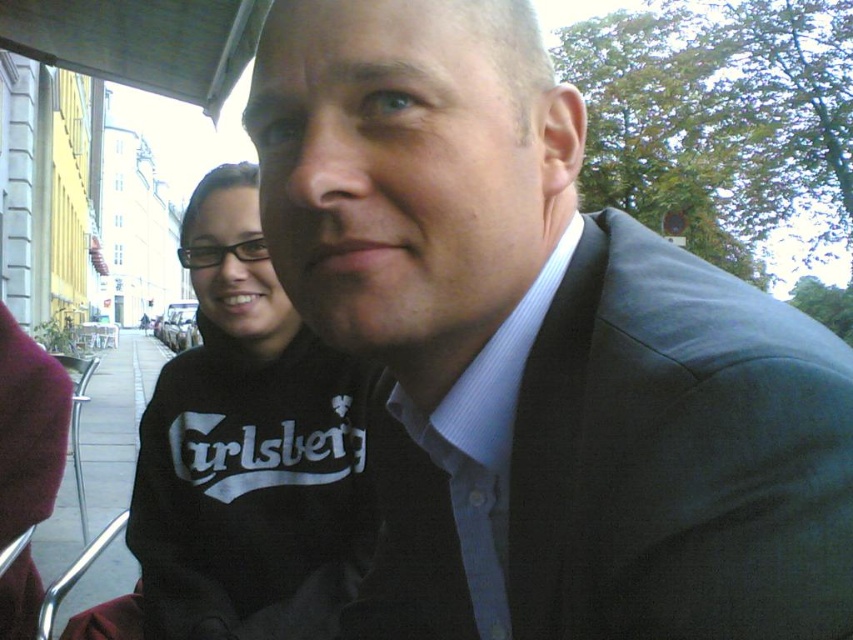
Question: Does matte black suit at center appear on the right side of black cotton sweatshirt at center?

Choices:
 (A) yes
 (B) no

Answer: (A)

Question: Does matte black suit at center appear under black cotton sweatshirt at center?

Choices:
 (A) no
 (B) yes

Answer: (A)

Question: Which of the following is the closest to the observer?

Choices:
 (A) (297, 413)
 (B) (498, 6)

Answer: (B)

Question: Does matte black suit at center appear on the right side of black cotton sweatshirt at center?

Choices:
 (A) yes
 (B) no

Answer: (A)

Question: Which of the following is the farthest from the observer?

Choices:
 (A) (552, 490)
 (B) (366, 500)

Answer: (B)